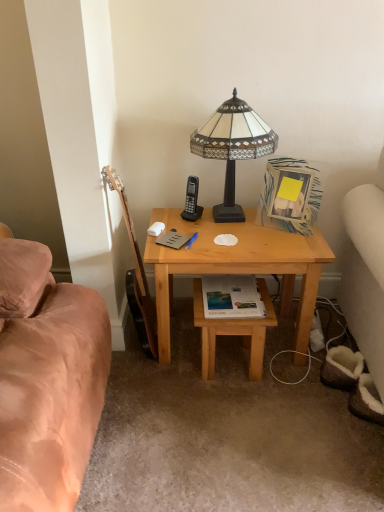
Find the location of `black plastic phone at center`. black plastic phone at center is located at coordinates (192, 200).

Describe the element at coordinates (232, 297) in the screenshot. I see `matte paper book at center, placed as the 2th book when sorted from top to bottom` at that location.

At what (x,y) coordinates should I click in order to perform the action: click on light brown wooden stool at lower center. Please return your answer as a coordinate pair (x, y). This screenshot has width=384, height=512. Looking at the image, I should click on (233, 332).

Who is taller, matte gray book at center, which ranks as the first book in top-to-bottom order, or light brown wooden stool at lower center?

With more height is light brown wooden stool at lower center.

From the image's perspective, between matte gray book at center, marked as the 1th book in a left-to-right arrangement, and light brown wooden stool at lower center, which one is located above?

matte gray book at center, marked as the 1th book in a left-to-right arrangement, appears higher in the image.

From a real-world perspective, who is located lower, matte gray book at center, which ranks as the first book in top-to-bottom order, or light brown wooden stool at lower center?

In real-world perspective, light brown wooden stool at lower center is lower.

Considering the positions of objects matte gray book at center, marked as the 1th book in a left-to-right arrangement, and light brown wooden stool at lower center in the image provided, who is in front, matte gray book at center, marked as the 1th book in a left-to-right arrangement, or light brown wooden stool at lower center?

Positioned in front is light brown wooden stool at lower center.

This screenshot has height=512, width=384. I want to click on the 2nd book behind when counting from the stained glass lampshade at upper center, so click(x=172, y=239).

Between matte gray book at center, which ranks as the first book in top-to-bottom order, and stained glass lampshade at upper center, which one has larger size?

stained glass lampshade at upper center is bigger.

Could you tell me if matte gray book at center, marked as the 1th book in a left-to-right arrangement, is facing stained glass lampshade at upper center?

No.

Considering the sizes of objects matte gray book at center, which is the 2th book from right to left, and stained glass lampshade at upper center in the image provided, who is shorter, matte gray book at center, which is the 2th book from right to left, or stained glass lampshade at upper center?

With less height is matte gray book at center, which is the 2th book from right to left.

How different are the orientations of black plastic phone at center and light wood desk at center in degrees?

The angle between the facing direction of black plastic phone at center and the facing direction of light wood desk at center is 35.1 degrees.

From the image's perspective, relative to light wood desk at center, is black plastic phone at center above or below?

Clearly, from the image's perspective, black plastic phone at center is above light wood desk at center.

Considering their positions, is black plastic phone at center located in front of or behind light wood desk at center?

Clearly, black plastic phone at center is behind light wood desk at center.

Consider the image. Is black plastic phone at center aimed at matte gray book at center, marked as the 1th book in a left-to-right arrangement?

Yes, black plastic phone at center is turned towards matte gray book at center, marked as the 1th book in a left-to-right arrangement.

Is black plastic phone at center not close to matte gray book at center, which ranks as the first book in top-to-bottom order?

No, there isn't a large distance between black plastic phone at center and matte gray book at center, which ranks as the first book in top-to-bottom order.

Based on the photo, which object is positioned more to the right, black plastic phone at center or matte gray book at center, which ranks as the first book in top-to-bottom order?

From the viewer's perspective, black plastic phone at center appears more on the right side.

Can you tell me how much black plastic phone at center and matte gray book at center, which is counted as the 2th book, starting from the bottom, differ in facing direction?

96.9 degrees.

Consider the image. Is stained glass lampshade at upper center thinner than brown wood guitar at left?

In fact, stained glass lampshade at upper center might be wider than brown wood guitar at left.

Is stained glass lampshade at upper center turned away from brown wood guitar at left?

No, stained glass lampshade at upper center's orientation is not away from brown wood guitar at left.

From a real-world perspective, does stained glass lampshade at upper center sit lower than brown wood guitar at left?

No.

Find the location of `lamp located above the brown wood guitar at left (from a real-world perspective)`. lamp located above the brown wood guitar at left (from a real-world perspective) is located at coordinates (233, 147).

Between matte paper book at center, which is counted as the first book, starting from the right, and brown wood guitar at left, which one appears on the left side from the viewer's perspective?

brown wood guitar at left is more to the left.

Does point (251, 311) come behind point (134, 248)?

That is False.

Is matte paper book at center, which is counted as the first book, starting from the right, placed right next to brown wood guitar at left?

matte paper book at center, which is counted as the first book, starting from the right, is not next to brown wood guitar at left, and they're not touching.

From the image's perspective, is matte paper book at center, which is counted as the first book, starting from the right, located above brown wood guitar at left?

No, from the image's perspective, matte paper book at center, which is counted as the first book, starting from the right, is not above brown wood guitar at left.

From a real-world perspective, between light brown wooden stool at lower center and matte paper book at center, positioned as the 1th book in bottom-to-top order, who is vertically lower?

light brown wooden stool at lower center, from a real-world perspective.

Does light brown wooden stool at lower center appear on the right side of matte paper book at center, which is counted as the first book, starting from the right?

Correct, you'll find light brown wooden stool at lower center to the right of matte paper book at center, which is counted as the first book, starting from the right.

What's the angular difference between light brown wooden stool at lower center and matte paper book at center, which is counted as the first book, starting from the right,'s facing directions?

179 degrees separate the facing orientations of light brown wooden stool at lower center and matte paper book at center, which is counted as the first book, starting from the right.

Does light brown wooden stool at lower center have a lesser width compared to matte paper book at center, which is counted as the first book, starting from the right?

No, light brown wooden stool at lower center is not thinner than matte paper book at center, which is counted as the first book, starting from the right.

I want to click on stool in front of the matte gray book at center, which ranks as the first book in top-to-bottom order, so click(x=233, y=332).

Where is `the 1st book below the stained glass lampshade at upper center (from the image's perspective)`? the 1st book below the stained glass lampshade at upper center (from the image's perspective) is located at coordinates coord(172,239).

Considering their positions, is matte gray book at center, which is counted as the 2th book, starting from the bottom, positioned further to black plastic phone at center than matte paper book at center, positioned as the 1th book in bottom-to-top order?

matte paper book at center, positioned as the 1th book in bottom-to-top order, lies further to black plastic phone at center than the other object.

Which object lies further to the anchor point matte gray book at center, which is counted as the 2th book, starting from the bottom, light wood desk at center or black plastic phone at center?

light wood desk at center lies further to matte gray book at center, which is counted as the 2th book, starting from the bottom, than the other object.

Looking at the image, which one is located closer to matte gray book at center, marked as the 1th book in a left-to-right arrangement, brown wood guitar at left or matte paper book at center, positioned as the second book in left-to-right order?

Among the two, matte paper book at center, positioned as the second book in left-to-right order, is located nearer to matte gray book at center, marked as the 1th book in a left-to-right arrangement.

Based on the photo, which object lies further to the anchor point stained glass lampshade at upper center, light brown wooden stool at lower center or matte gray book at center, which is counted as the 2th book, starting from the bottom?

light brown wooden stool at lower center is positioned further to the anchor stained glass lampshade at upper center.

Considering their positions, is light brown wooden stool at lower center positioned further to brown wood guitar at left than stained glass lampshade at upper center?

stained glass lampshade at upper center.

When comparing their distances from brown wood guitar at left, does matte paper book at center, placed as the 2th book when sorted from top to bottom, or light wood desk at center seem further?

The object further to brown wood guitar at left is light wood desk at center.

Based on their spatial positions, is light wood desk at center or light brown wooden stool at lower center closer to stained glass lampshade at upper center?

Among the two, light wood desk at center is located nearer to stained glass lampshade at upper center.

From the picture: Which object lies nearer to the anchor point matte gray book at center, which ranks as the first book in top-to-bottom order, light wood desk at center or matte paper book at center, which is counted as the first book, starting from the right?

light wood desk at center lies closer to matte gray book at center, which ranks as the first book in top-to-bottom order, than the other object.

Locate an element on the screen. The height and width of the screenshot is (512, 384). desk between black plastic phone at center and light brown wooden stool at lower center vertically is located at coordinates (237, 265).

The image size is (384, 512). Identify the location of desk between stained glass lampshade at upper center and light brown wooden stool at lower center from top to bottom. (237, 265).

Locate an element on the screen. The width and height of the screenshot is (384, 512). mobile phone that lies between stained glass lampshade at upper center and brown wood guitar at left from top to bottom is located at coordinates (192, 200).

You are a GUI agent. You are given a task and a screenshot of the screen. Output one action in this format:
    pyautogui.click(x=<x>, y=<y>)
    Task: Click on the mobile phone between stained glass lampshade at upper center and light brown wooden stool at lower center in the vertical direction
    The width and height of the screenshot is (384, 512).
    Given the screenshot: What is the action you would take?
    pyautogui.click(x=192, y=200)